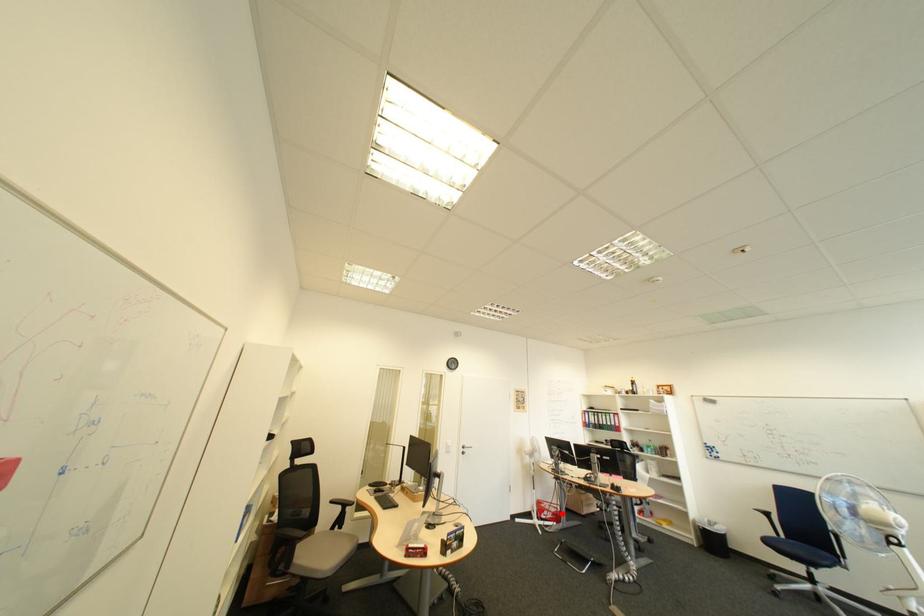
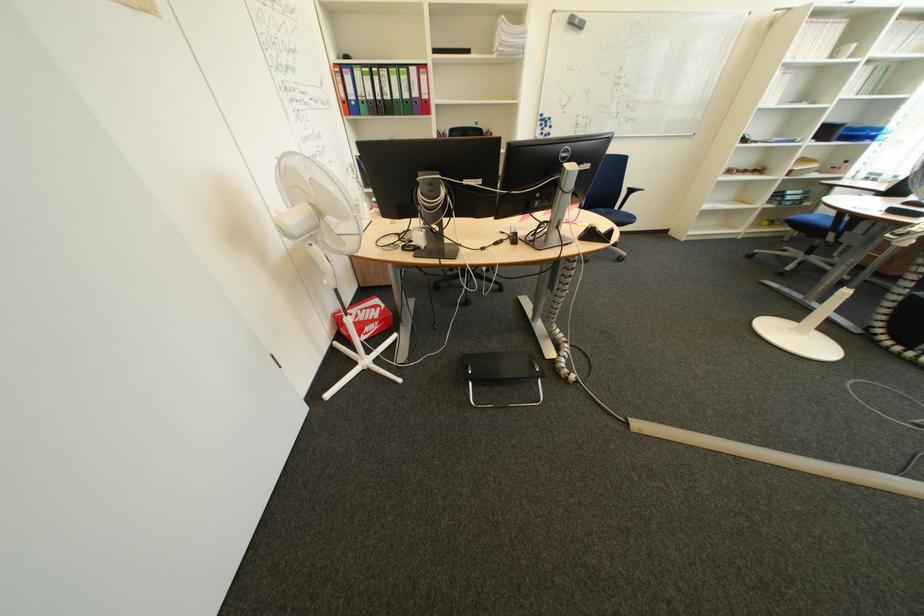
Where in the second image is the point corresponding to the highlighted location from the first image?

(385, 326)